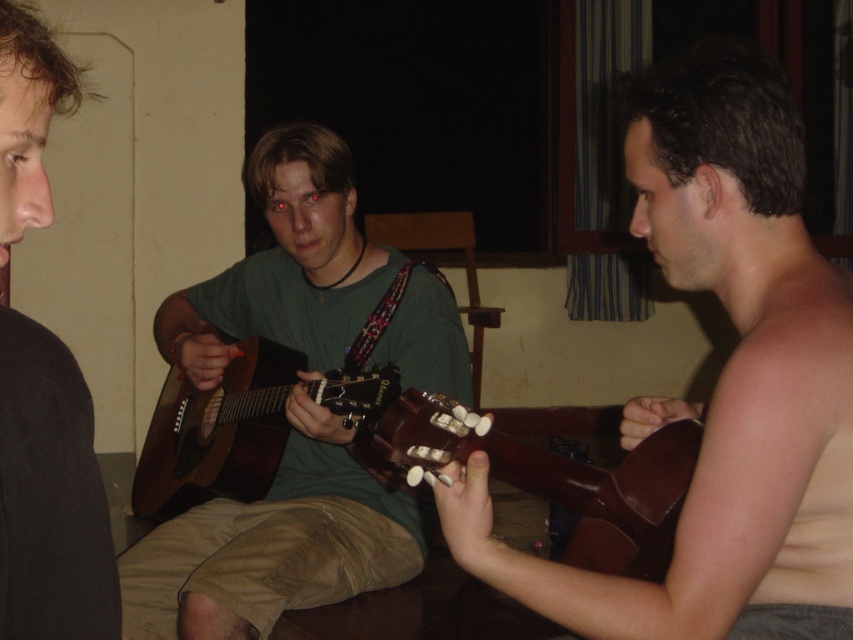
Does brown wood guitar at right come in front of green matte guitar at center?

Yes, brown wood guitar at right is in front of green matte guitar at center.

Between brown wood guitar at right and green matte guitar at center, which one appears on the left side from the viewer's perspective?

Positioned to the left is green matte guitar at center.

Who is more forward, (627, 589) or (318, 566)?

Positioned in front is point (627, 589).

Where is `brown wood guitar at right`? brown wood guitar at right is located at coordinates coord(721,378).

Can you confirm if green matte guitar at center is positioned below brown acoustic guitar at center?

Actually, green matte guitar at center is above brown acoustic guitar at center.

Can you confirm if green matte guitar at center is positioned above brown acoustic guitar at center?

Yes, green matte guitar at center is above brown acoustic guitar at center.

Is point (151, 612) in front of point (183, 433)?

Yes, point (151, 612) is closer to viewer.

Where is `green matte guitar at center`? green matte guitar at center is located at coordinates (276, 541).

Can you confirm if brown wood guitar at right is positioned to the left of brown acoustic guitar at center?

In fact, brown wood guitar at right is to the right of brown acoustic guitar at center.

Identify the location of brown wood guitar at right. (721, 378).

Where is `brown wood guitar at right`? brown wood guitar at right is located at coordinates (721, 378).